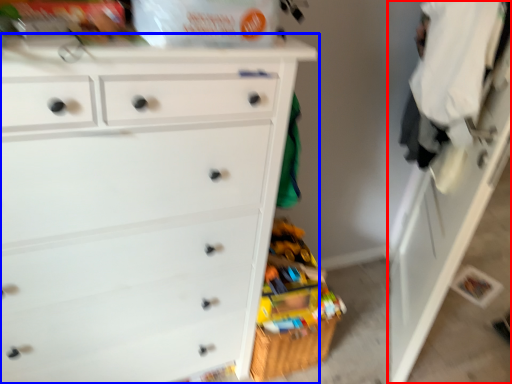
Question: Which of the following is the farthest to the observer, dresser (highlighted by a red box) or chest of drawers (highlighted by a blue box)?

Choices:
 (A) dresser
 (B) chest of drawers

Answer: (A)